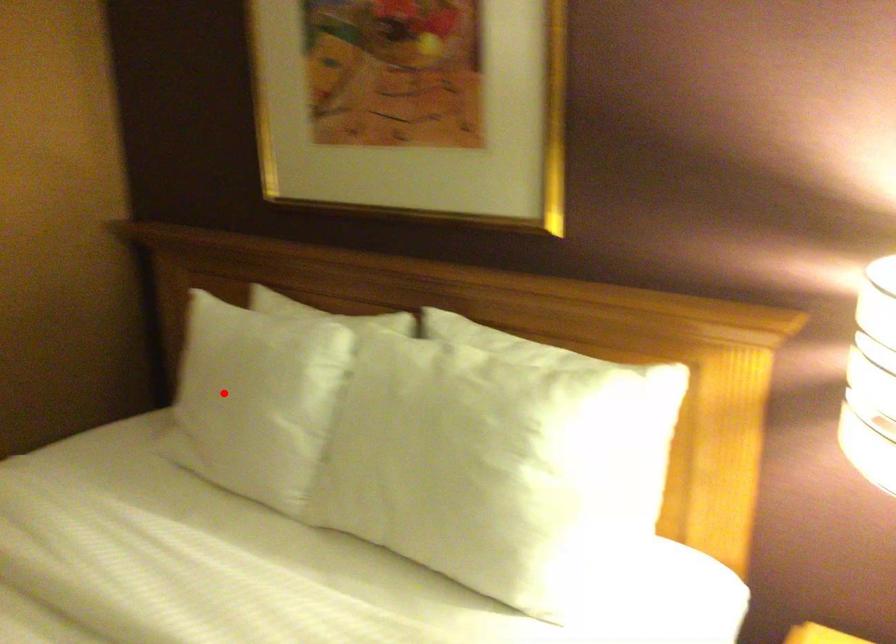
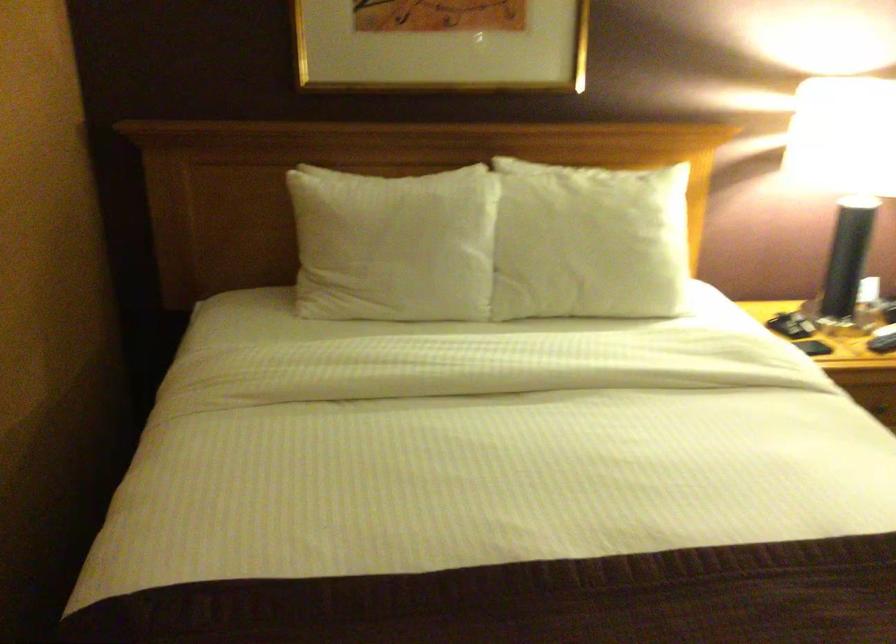
Question: I am providing you with two images of the same scene from different viewpoints. In image1, a red point is highlighted. Considering the same 3D point in image2, which of the following is correct?

Choices:
 (A) It is closer
 (B) It is farther

Answer: (B)